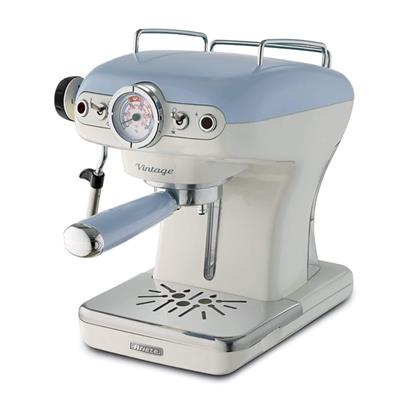
In order to click on switches in this screenshot , I will do `click(100, 112)`, `click(179, 122)`.